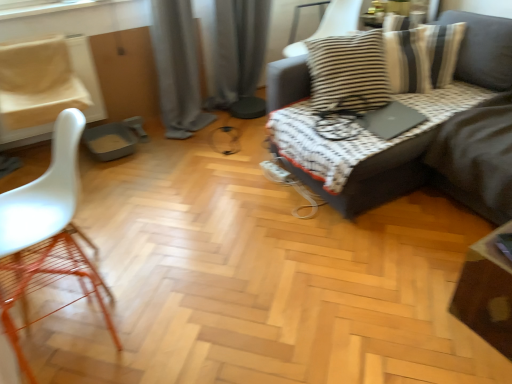
Where is `free space that is in between white matte chair at left, the 2th chair from the left, and gray fabric curtain at center, the first curtain when ordered from left to right`? free space that is in between white matte chair at left, the 2th chair from the left, and gray fabric curtain at center, the first curtain when ordered from left to right is located at coordinates (145, 193).